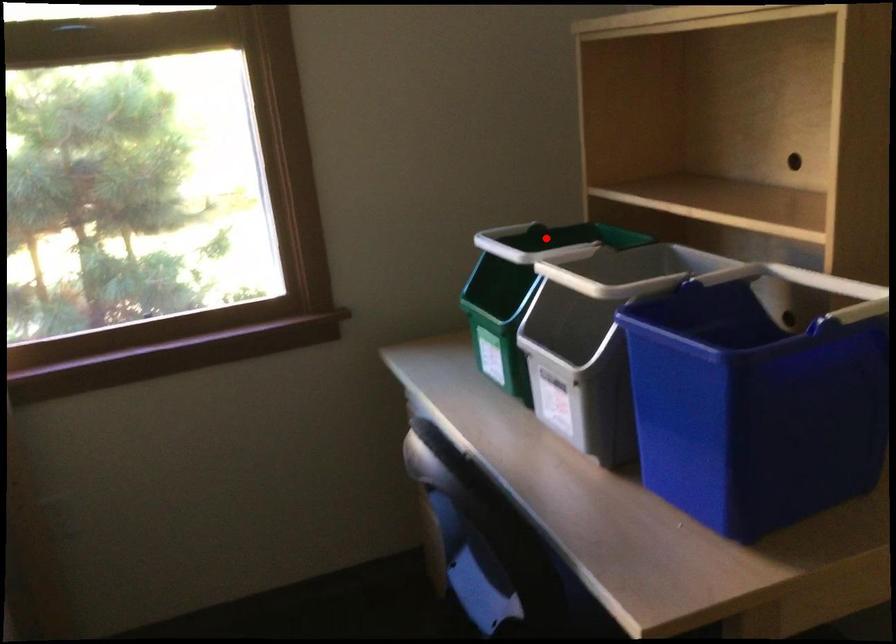
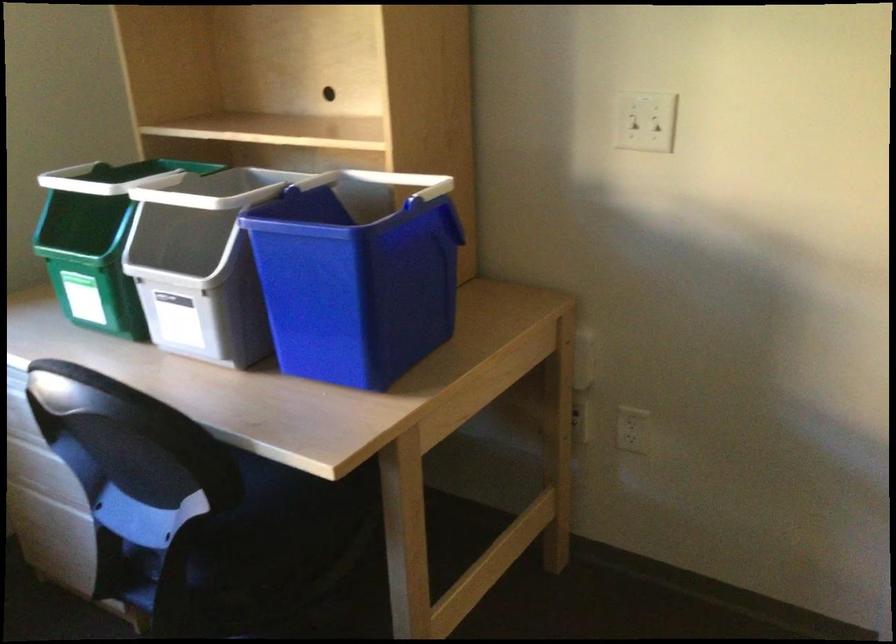
The point at the highlighted location is marked in the first image. Where is the corresponding point in the second image?

(116, 178)